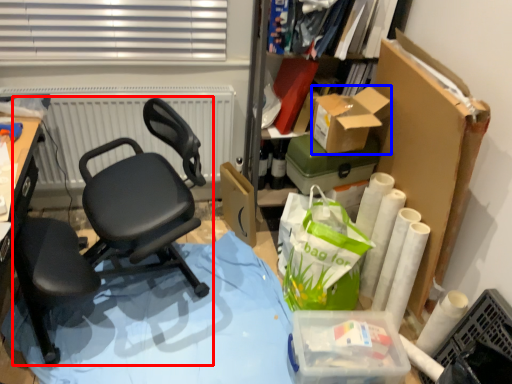
Question: Among these objects, which one is nearest to the camera, chair (highlighted by a red box) or box (highlighted by a blue box)?

Choices:
 (A) chair
 (B) box

Answer: (A)